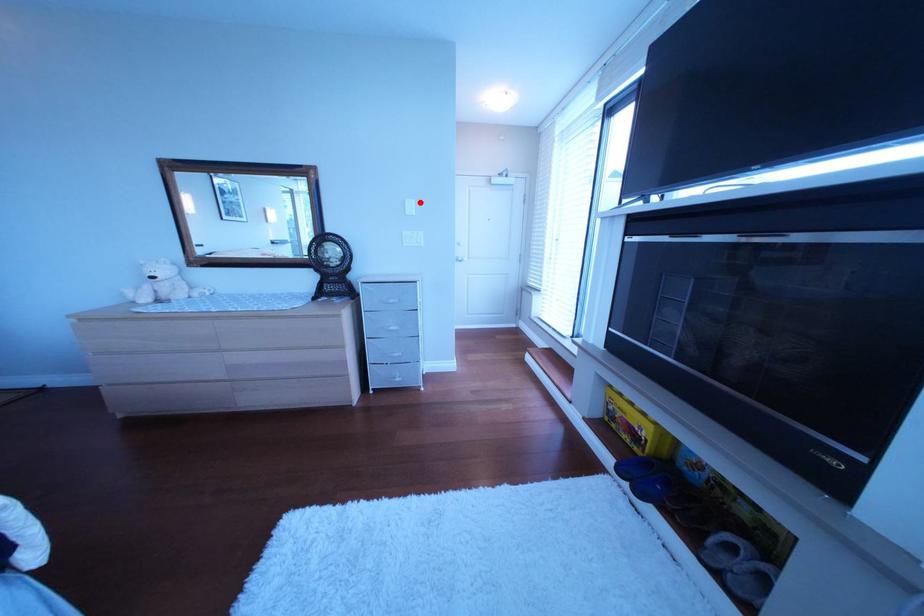
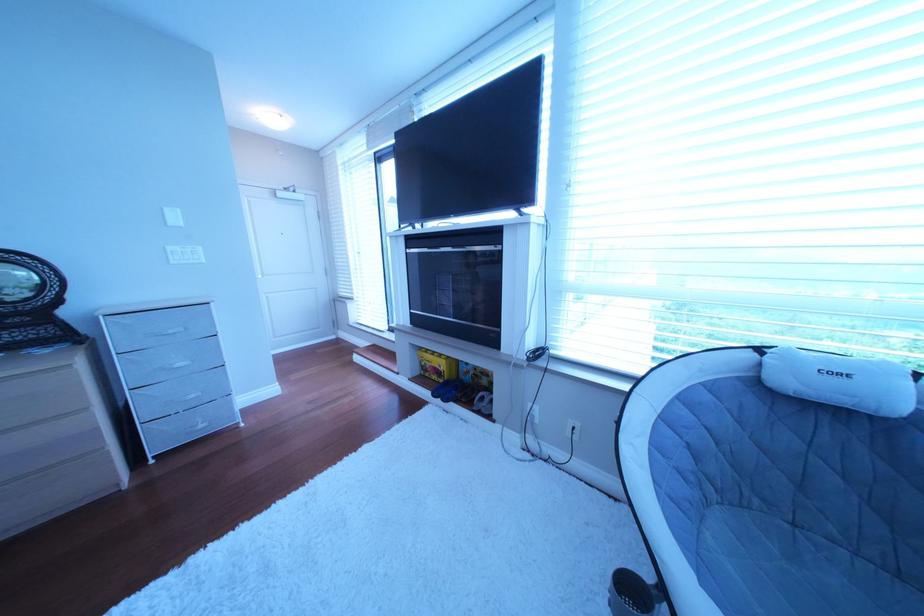
Question: I am providing you with two images of the same scene from different viewpoints. Given a red point in image1, look at the same physical point in image2. Is it:

Choices:
 (A) Closer to the viewpoint
 (B) Farther from the viewpoint

Answer: (B)